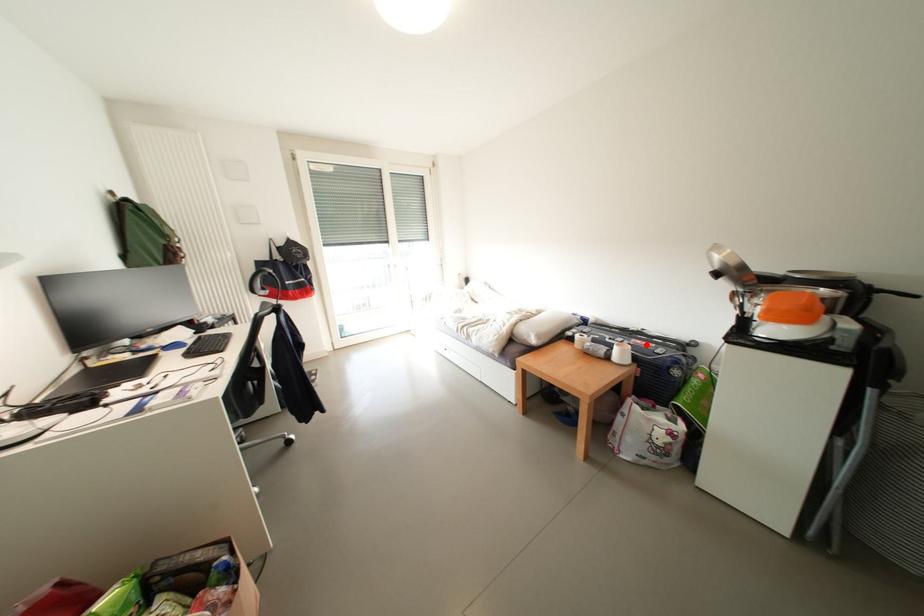
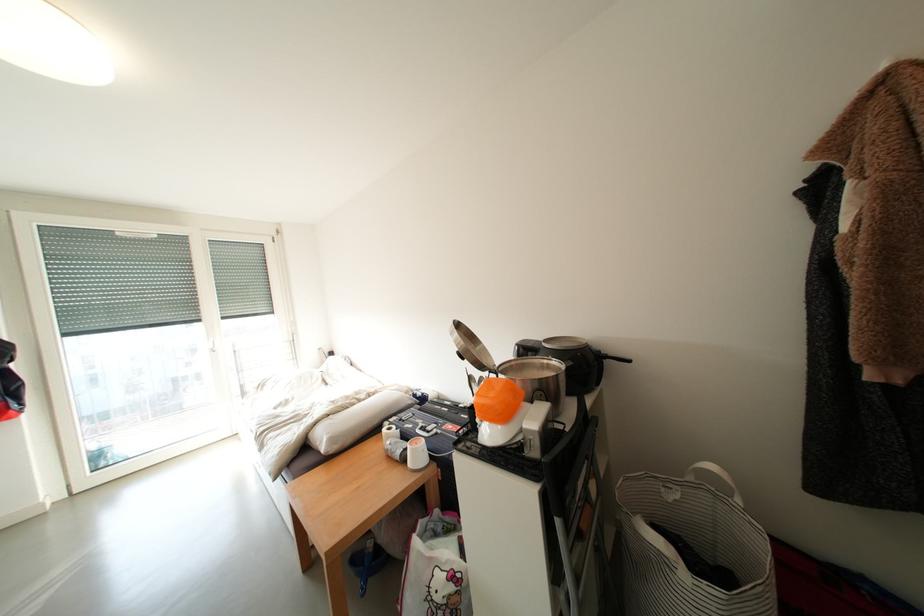
The point at the highlighted location is marked in the first image. Where is the corresponding point in the second image?

(457, 430)